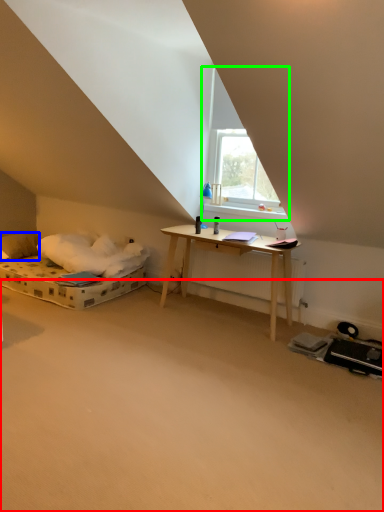
Question: Considering the real-world distances, which object is farthest from plain (highlighted by a red box)? pillow (highlighted by a blue box) or window (highlighted by a green box)?

Choices:
 (A) pillow
 (B) window

Answer: (A)